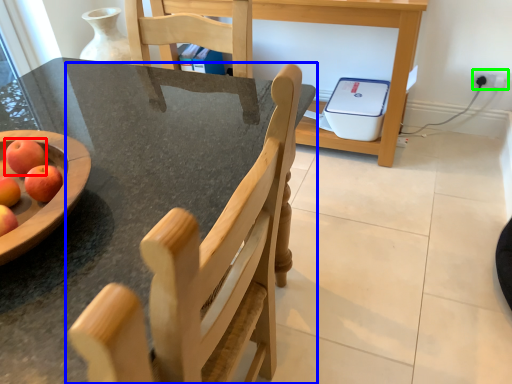
Question: Which object is the farthest from apple (highlighted by a red box)? Choose among these: chair (highlighted by a blue box) or electric outlet (highlighted by a green box).

Choices:
 (A) chair
 (B) electric outlet

Answer: (B)